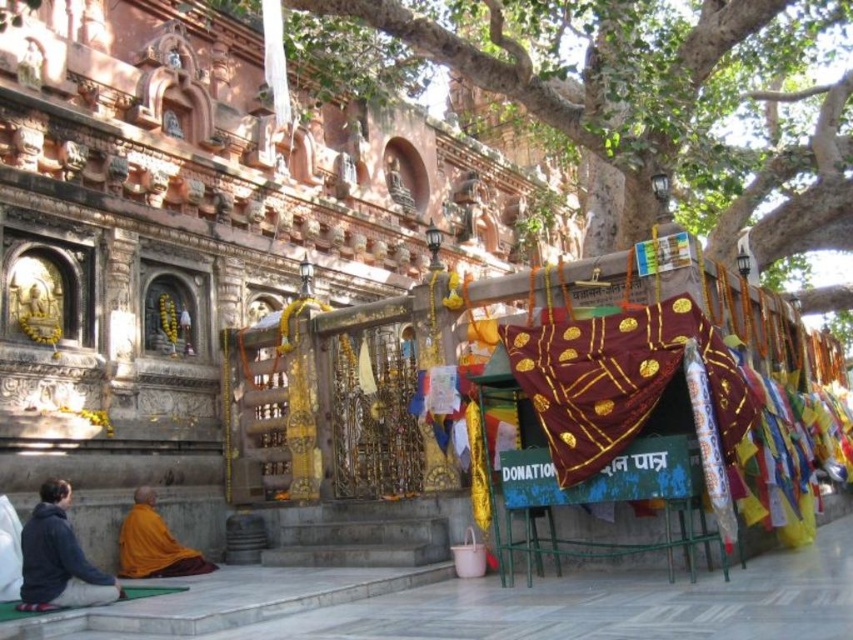
You are standing at the entrance of the temple and want to take a photo of the point at coordinates point (772, 102). If your camera has a maximum focus range of 80 meters, will you be able to focus on that point?

The distance of point (772, 102) from the camera is 88.55 meters, which exceeds the camera maximum focus range of 80 meters. Therefore, the camera cannot focus on that point.

In the scene shown: You are a visitor at the temple and see the dark blue hoodie at lower left and the orange cloth monk at lower left. Which item is positioned higher from the ground?

The dark blue hoodie at lower left is above the orange cloth monk at lower left, so it is positioned higher from the ground.

You are standing at the entrance of the temple and see two points marked in the scene. One is at coordinate point (775, 252) and the other is at coordinate point (39, 529). Which point is closer to you?

Point (39, 529) is closer to you because it is in front of point (775, 252) according to the spatial description.